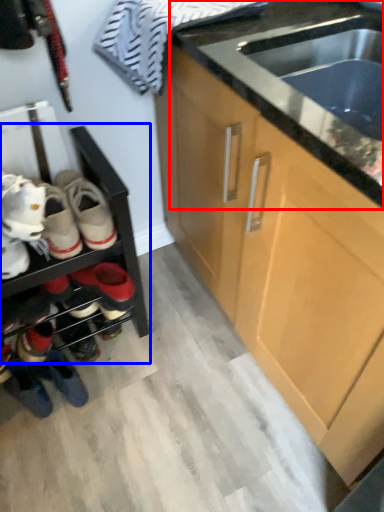
Question: Which object appears closest to the camera in this image, countertop (highlighted by a red box) or shelf (highlighted by a blue box)?

Choices:
 (A) countertop
 (B) shelf

Answer: (A)